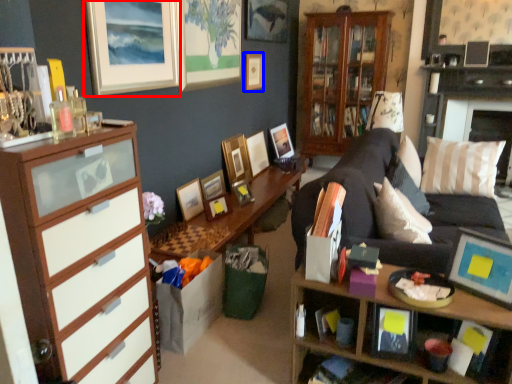
Question: Which object appears farthest to the camera in this image, picture frame (highlighted by a red box) or picture frame (highlighted by a blue box)?

Choices:
 (A) picture frame
 (B) picture frame

Answer: (B)